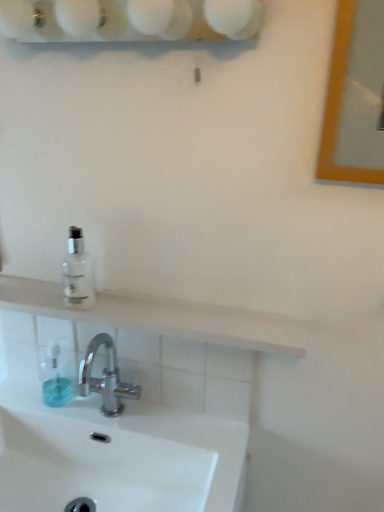
Where is `white matte shelf at upper center`? Image resolution: width=384 pixels, height=512 pixels. white matte shelf at upper center is located at coordinates (160, 317).

Identify the location of wooden frame mirror at upper right. (355, 97).

Describe the element at coordinates (116, 455) in the screenshot. I see `white glossy sink at lower center` at that location.

Describe the element at coordinates (130, 19) in the screenshot. I see `white glossy shelf at upper center` at that location.

Locate an element on the screen. This screenshot has height=512, width=384. transparent plastic soap dispenser at lower left is located at coordinates (57, 377).

At what (x,y) coordinates should I click in order to perform the action: click on white matte shelf at upper center. Please return your answer as a coordinate pair (x, y). Image resolution: width=384 pixels, height=512 pixels. Looking at the image, I should click on (160, 317).

Is white matte shelf at upper center looking in the opposite direction of wooden frame mirror at upper right?

white matte shelf at upper center is not turned away from wooden frame mirror at upper right.

Based on the photo, is wooden frame mirror at upper right completely or partially inside white matte shelf at upper center?

No.

Is white matte shelf at upper center behind wooden frame mirror at upper right?

Yes, white matte shelf at upper center is further from the camera.

Is white glossy shelf at upper center oriented towards white glossy sink at lower center?

No, white glossy shelf at upper center is not turned towards white glossy sink at lower center.

Can you confirm if white glossy shelf at upper center is shorter than white glossy sink at lower center?

Indeed, white glossy shelf at upper center has a lesser height compared to white glossy sink at lower center.

From a real-world perspective, is white glossy shelf at upper center physically located above or below white glossy sink at lower center?

In terms of real-world spatial position, white glossy shelf at upper center is above white glossy sink at lower center.

Can you confirm if white glossy shelf at upper center is positioned to the right of white glossy sink at lower center?

Yes.

Is transparent glass bottle at upper left spatially inside white matte shelf at upper center, or outside of it?

transparent glass bottle at upper left lies outside white matte shelf at upper center.

Which of these two, transparent glass bottle at upper left or white matte shelf at upper center, is thinner?

transparent glass bottle at upper left.

How many degrees apart are the facing directions of transparent glass bottle at upper left and white matte shelf at upper center?

The angle between the facing direction of transparent glass bottle at upper left and the facing direction of white matte shelf at upper center is 0.00894 degrees.

How much distance is there between transparent glass bottle at upper left and white matte shelf at upper center?

transparent glass bottle at upper left and white matte shelf at upper center are 5.78 inches apart from each other.

From the image's perspective, between transparent glass bottle at upper left and transparent plastic soap dispenser at lower left, which one is located above?

transparent glass bottle at upper left.

Does transparent glass bottle at upper left touch transparent plastic soap dispenser at lower left?

No.

Considering the sizes of objects transparent glass bottle at upper left and transparent plastic soap dispenser at lower left in the image provided, who is wider, transparent glass bottle at upper left or transparent plastic soap dispenser at lower left?

Wider between the two is transparent glass bottle at upper left.

Does transparent glass bottle at upper left have a larger size compared to transparent plastic soap dispenser at lower left?

Yes.

Considering the relative positions of wooden frame mirror at upper right and white matte shelf at upper center in the image provided, is wooden frame mirror at upper right to the right of white matte shelf at upper center from the viewer's perspective?

Correct, you'll find wooden frame mirror at upper right to the right of white matte shelf at upper center.

Is white matte shelf at upper center surrounded by wooden frame mirror at upper right?

No.

Is wooden frame mirror at upper right positioned far away from white matte shelf at upper center?

No, wooden frame mirror at upper right is not far from white matte shelf at upper center.

What are the coordinates of `mouthwash above the white glossy sink at lower center (from the image's perspective)` in the screenshot? It's located at (77, 273).

Who is shorter, white glossy sink at lower center or transparent glass bottle at upper left?

white glossy sink at lower center is shorter.

Does white glossy sink at lower center appear on the right side of transparent glass bottle at upper left?

Yes.

Considering the sizes of objects transparent glass bottle at upper left and white glossy sink at lower center in the image provided, who is smaller, transparent glass bottle at upper left or white glossy sink at lower center?

Smaller between the two is transparent glass bottle at upper left.

Locate an element on the screen. sink located on the right of transparent glass bottle at upper left is located at coordinates (116, 455).

From a real-world perspective, which is physically above, transparent glass bottle at upper left or white glossy sink at lower center?

transparent glass bottle at upper left.

How many degrees apart are the facing directions of transparent glass bottle at upper left and white glossy sink at lower center?

0.00304 degrees.

Find the location of `counter top directly beneath the wooden frame mirror at upper right (from a real-world perspective)`. counter top directly beneath the wooden frame mirror at upper right (from a real-world perspective) is located at coordinates (160, 317).

The width and height of the screenshot is (384, 512). In order to click on sink located below the white glossy shelf at upper center (from the image's perspective) in this screenshot , I will do `click(116, 455)`.

Based on their spatial positions, is white glossy shelf at upper center or white matte shelf at upper center closer to transparent glass bottle at upper left?

Based on the image, white matte shelf at upper center appears to be nearer to transparent glass bottle at upper left.

When comparing their distances from transparent plastic soap dispenser at lower left, does wooden frame mirror at upper right or white glossy shelf at upper center seem further?

Among the two, wooden frame mirror at upper right is located further to transparent plastic soap dispenser at lower left.

When comparing their distances from white glossy sink at lower center, does white matte shelf at upper center or transparent plastic soap dispenser at lower left seem closer?

transparent plastic soap dispenser at lower left is closer to white glossy sink at lower center.

Based on their spatial positions, is white glossy shelf at upper center or transparent plastic soap dispenser at lower left closer to white glossy sink at lower center?

transparent plastic soap dispenser at lower left.

Estimate the real-world distances between objects in this image. Which object is closer to white glossy sink at lower center, wooden frame mirror at upper right or transparent plastic soap dispenser at lower left?

The object closer to white glossy sink at lower center is transparent plastic soap dispenser at lower left.

From the image, which object appears to be farther from transparent glass bottle at upper left, white glossy sink at lower center or transparent plastic soap dispenser at lower left?

white glossy sink at lower center lies further to transparent glass bottle at upper left than the other object.

Looking at this image, which object lies nearer to the anchor point transparent glass bottle at upper left, white glossy sink at lower center or wooden frame mirror at upper right?

white glossy sink at lower center.

When comparing their distances from transparent glass bottle at upper left, does wooden frame mirror at upper right or white matte shelf at upper center seem further?

Based on the image, wooden frame mirror at upper right appears to be further to transparent glass bottle at upper left.

Image resolution: width=384 pixels, height=512 pixels. What are the coordinates of `counter top that lies between white glossy shelf at upper center and transparent plastic soap dispenser at lower left from top to bottom` in the screenshot? It's located at (160, 317).

The height and width of the screenshot is (512, 384). I want to click on counter top between white glossy sink at lower center and transparent plastic soap dispenser at lower left along the z-axis, so click(160, 317).

I want to click on counter top between transparent plastic soap dispenser at lower left and wooden frame mirror at upper right, so click(x=160, y=317).

Find the location of a particular element. The height and width of the screenshot is (512, 384). counter top that lies between wooden frame mirror at upper right and white glossy sink at lower center from top to bottom is located at coordinates (160, 317).